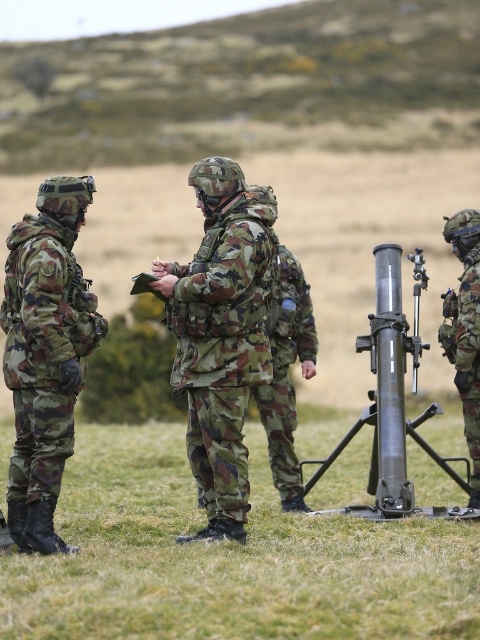
You are a soldier in the field and need to reach a specific point marked at coordinates point (201, 321). Your current position is 5 meters away from this point. Can you safely move to this point without needing to adjust your position further?

The distance of point (201, 321) from viewer is 6.78 meters, so you are currently 5 meters away, meaning you still need to move an additional 1.78 meters to reach the point. Therefore, you need to adjust your position further to reach the point safely.

You are a soldier in the field and need to move from the camo fabric uniform at left to the camouflage fabric helmet at right. Can you walk directly between them without needing to detour around any obstacles?

The distance between the camo fabric uniform at left and the camouflage fabric helmet at right is 8.04 feet, so yes, you can walk directly between them without needing to detour around any obstacles since there is sufficient space.

You are a photographer trying to capture a clear photo of both the camouflage fabric uniform at center and the camo fabric uniform at left. Which uniform should you focus on first to ensure both are in focus?

The camouflage fabric uniform at center is positioned over the camo fabric uniform at left, so you should focus on the camouflage fabric uniform at center first to ensure both are in focus.